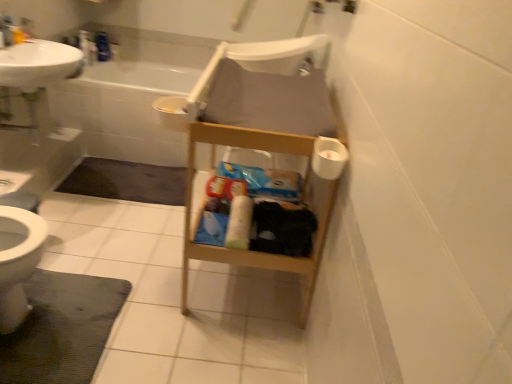
I want to click on vacant space behind dark gray textured bath mat at lower left, the 2th bath mat in the back-to-front sequence, so click(115, 245).